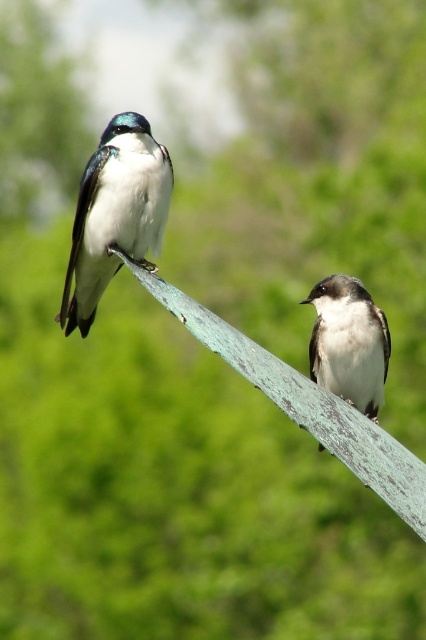
You are a park visitor observing two birds on a metal pole. You see the shiny white bird at upper left and the white matte bird at center. Which bird is positioned higher on the pole?

The shiny white bird at upper left is positioned higher than the white matte bird at center.

You are standing in a park and see two points marked in the image. The first point is at coordinates point (109,184) and the second is at point (328,289). Which point is closer to you?

Point (109,184) is in front of point (328,289), so it is closer to you.

You are a birdwatcher trying to capture both birds in a single photo. The shiny white bird at upper left and the white matte bird at center are both in your viewfinder. Based on their sizes in the image, which bird would you focus on first to ensure both fit in the frame?

The shiny white bird at upper left occupies less space than the white matte bird at center, so you should focus on the white matte bird at center first to ensure it fits properly, then adjust to include the smaller shiny white bird at upper left.